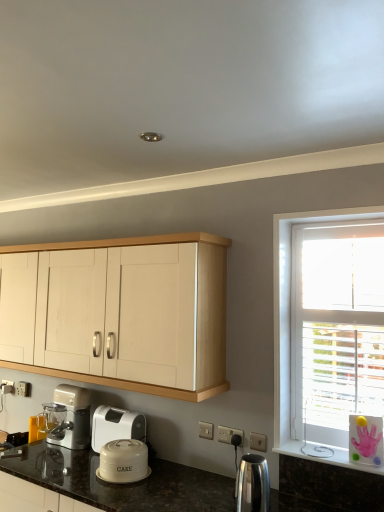
What do you see at coordinates (253, 484) in the screenshot?
I see `polished stainless steel kettle at lower center, the first kitchen appliance in the front-to-back sequence` at bounding box center [253, 484].

In order to face matte silver blender at lower left, positioned as the 2th home appliance in right-to-left order, should I rotate leftwards or rightwards?

You should rotate left by 16.493 degrees.

The width and height of the screenshot is (384, 512). Describe the element at coordinates (206, 430) in the screenshot. I see `white plastic electric outlet at lower center` at that location.

Image resolution: width=384 pixels, height=512 pixels. I want to click on matte white cake container at lower center, acting as the 1th kitchen appliance starting from the back, so click(x=123, y=461).

Image resolution: width=384 pixels, height=512 pixels. What are the coordinates of `polished stainless steel kettle at lower center, acting as the 2th kitchen appliance starting from the back` in the screenshot? It's located at (253, 484).

Can you tell me how much white plastic electric outlet at lower center and light wood cabinet at upper center differ in facing direction?

The facing directions of white plastic electric outlet at lower center and light wood cabinet at upper center are 1.77 degrees apart.

Is white plastic electric outlet at lower center in contact with light wood cabinet at upper center?

No.

Between white plastic electric outlet at lower center and light wood cabinet at upper center, which one is positioned in front?

Positioned in front is light wood cabinet at upper center.

From a real-world perspective, is white plastic electric outlet at lower center on top of light wood cabinet at upper center?

No.

Is matte silver blender at lower left, positioned as the 2th home appliance in right-to-left order, with polished stainless steel kettle at lower center, the first kitchen appliance in the front-to-back sequence?

They are not placed beside each other.

Looking at their sizes, would you say matte silver blender at lower left, which is counted as the 1th home appliance, starting from the left, is wider or thinner than polished stainless steel kettle at lower center, acting as the 2th kitchen appliance starting from the back?

Clearly, matte silver blender at lower left, which is counted as the 1th home appliance, starting from the left, has less width compared to polished stainless steel kettle at lower center, acting as the 2th kitchen appliance starting from the back.

Is matte silver blender at lower left, which is counted as the 1th home appliance, starting from the left, surrounding polished stainless steel kettle at lower center, the first kitchen appliance in the front-to-back sequence?

No, polished stainless steel kettle at lower center, the first kitchen appliance in the front-to-back sequence, is not a part of matte silver blender at lower left, which is counted as the 1th home appliance, starting from the left.

Is polished stainless steel kettle at lower center, which appears as the second kitchen appliance when viewed from the left, oriented away from light wood cabinet at upper center?

polished stainless steel kettle at lower center, which appears as the second kitchen appliance when viewed from the left, does not have its back to light wood cabinet at upper center.

Considering the sizes of objects polished stainless steel kettle at lower center, acting as the 1th kitchen appliance starting from the right, and light wood cabinet at upper center in the image provided, who is thinner, polished stainless steel kettle at lower center, acting as the 1th kitchen appliance starting from the right, or light wood cabinet at upper center?

With smaller width is polished stainless steel kettle at lower center, acting as the 1th kitchen appliance starting from the right.

Between polished stainless steel kettle at lower center, acting as the 2th kitchen appliance starting from the back, and light wood cabinet at upper center, which one has less height?

polished stainless steel kettle at lower center, acting as the 2th kitchen appliance starting from the back, is shorter.

Are polished stainless steel kettle at lower center, the first kitchen appliance in the front-to-back sequence, and light wood cabinet at upper center located far from each other?

No, polished stainless steel kettle at lower center, the first kitchen appliance in the front-to-back sequence, is not far from light wood cabinet at upper center.

Is white plastic container at lower center, marked as the 2th home appliance in a left-to-right arrangement, spatially inside light wood cabinet at upper center, or outside of it?

The correct answer is: outside.

Is light wood cabinet at upper center at the back of white plastic container at lower center, marked as the 2th home appliance in a left-to-right arrangement?

No, white plastic container at lower center, marked as the 2th home appliance in a left-to-right arrangement,'s orientation is not away from light wood cabinet at upper center.

Would you consider white plastic container at lower center, arranged as the 1th home appliance when viewed from the right, to be distant from light wood cabinet at upper center?

Actually, white plastic container at lower center, arranged as the 1th home appliance when viewed from the right, and light wood cabinet at upper center are a little close together.

Is white plastic electric outlet at lower center placed right next to matte silver blender at lower left, positioned as the 2th home appliance in right-to-left order?

No, white plastic electric outlet at lower center is not next to matte silver blender at lower left, positioned as the 2th home appliance in right-to-left order.

From the image's perspective, which one is positioned higher, white plastic electric outlet at lower center or matte silver blender at lower left, which is counted as the 1th home appliance, starting from the left?

white plastic electric outlet at lower center appears higher in the image.

Which is more to the right, white plastic electric outlet at lower center or matte silver blender at lower left, positioned as the 2th home appliance in right-to-left order?

white plastic electric outlet at lower center is more to the right.

From the image's perspective, count 1st home appliances downward from the white plastic electric outlet at lower center and point to it. Please provide its 2D coordinates.

[(72, 418)]

Is polished stainless steel kettle at lower center, the first kitchen appliance in the front-to-back sequence, inside the boundaries of matte white cake container at lower center, acting as the 1th kitchen appliance starting from the back, or outside?

polished stainless steel kettle at lower center, the first kitchen appliance in the front-to-back sequence, is located beyond the bounds of matte white cake container at lower center, acting as the 1th kitchen appliance starting from the back.

Does point (255, 498) come closer to viewer compared to point (102, 458)?

Yes, it is in front of point (102, 458).

Would you consider polished stainless steel kettle at lower center, acting as the 1th kitchen appliance starting from the right, to be distant from matte white cake container at lower center, arranged as the 2th kitchen appliance when viewed from the right?

No, polished stainless steel kettle at lower center, acting as the 1th kitchen appliance starting from the right, is not far from matte white cake container at lower center, arranged as the 2th kitchen appliance when viewed from the right.

Considering the positions of objects polished stainless steel kettle at lower center, which appears as the second kitchen appliance when viewed from the left, and matte white cake container at lower center, arranged as the 2th kitchen appliance when viewed from the right, in the image provided, who is more to the left, polished stainless steel kettle at lower center, which appears as the second kitchen appliance when viewed from the left, or matte white cake container at lower center, arranged as the 2th kitchen appliance when viewed from the right,?

→ From the viewer's perspective, matte white cake container at lower center, arranged as the 2th kitchen appliance when viewed from the right, appears more on the left side.

Would you say white plastic container at lower center, arranged as the 1th home appliance when viewed from the right, is outside polished stainless steel kettle at lower center, acting as the 2th kitchen appliance starting from the back?

Indeed, white plastic container at lower center, arranged as the 1th home appliance when viewed from the right, is completely outside polished stainless steel kettle at lower center, acting as the 2th kitchen appliance starting from the back.

Is point (120, 417) farther from camera compared to point (243, 461)?

Yes, point (120, 417) is farther from viewer.

Which home appliance is the 1st one when counting from the back of the polished stainless steel kettle at lower center, acting as the 2th kitchen appliance starting from the back? Please provide its 2D coordinates.

[(116, 426)]

Can you tell me how much white plastic container at lower center, marked as the 2th home appliance in a left-to-right arrangement, and polished stainless steel kettle at lower center, acting as the 1th kitchen appliance starting from the right, differ in facing direction?

The angular difference between white plastic container at lower center, marked as the 2th home appliance in a left-to-right arrangement, and polished stainless steel kettle at lower center, acting as the 1th kitchen appliance starting from the right, is 2.11 degrees.

The image size is (384, 512). In the image, there is a light wood cabinet at upper center. What are the coordinates of `electric outlet below it (from the image's perspective)` in the screenshot? It's located at (206, 430).

Image resolution: width=384 pixels, height=512 pixels. In order to click on the 2nd home appliance behind the polished stainless steel kettle at lower center, which appears as the second kitchen appliance when viewed from the left in this screenshot , I will do `click(72, 418)`.

Which object lies further to the anchor point matte silver blender at lower left, which is counted as the 1th home appliance, starting from the left, white plastic container at lower center, marked as the 2th home appliance in a left-to-right arrangement, or white plastic electric outlet at lower center?

white plastic electric outlet at lower center is positioned further to the anchor matte silver blender at lower left, which is counted as the 1th home appliance, starting from the left.

Considering their positions, is white plastic electric outlet at lower center positioned closer to white plastic container at lower center, marked as the 2th home appliance in a left-to-right arrangement, than light wood cabinet at upper center?

white plastic electric outlet at lower center is positioned closer to the anchor white plastic container at lower center, marked as the 2th home appliance in a left-to-right arrangement.

Which object lies nearer to the anchor point polished stainless steel kettle at lower center, acting as the 2th kitchen appliance starting from the back, matte silver blender at lower left, positioned as the 2th home appliance in right-to-left order, or white plastic container at lower center, arranged as the 1th home appliance when viewed from the right?

white plastic container at lower center, arranged as the 1th home appliance when viewed from the right.

Which object lies nearer to the anchor point polished stainless steel kettle at lower center, the first kitchen appliance in the front-to-back sequence, matte white cake container at lower center, which appears as the 2th kitchen appliance when viewed from the front, or white plastic electric outlet at lower center?

Among the two, white plastic electric outlet at lower center is located nearer to polished stainless steel kettle at lower center, the first kitchen appliance in the front-to-back sequence.

When comparing their distances from matte white cake container at lower center, the 1th kitchen appliance positioned from the left, does matte silver blender at lower left, which is counted as the 1th home appliance, starting from the left, or white plastic electric outlet at lower center seem closer?

white plastic electric outlet at lower center.

Based on their spatial positions, is white plastic container at lower center, arranged as the 1th home appliance when viewed from the right, or matte silver blender at lower left, positioned as the 2th home appliance in right-to-left order, further from matte white cake container at lower center, acting as the 1th kitchen appliance starting from the back?

Based on the image, matte silver blender at lower left, positioned as the 2th home appliance in right-to-left order, appears to be further to matte white cake container at lower center, acting as the 1th kitchen appliance starting from the back.

Which object lies further to the anchor point polished stainless steel kettle at lower center, the first kitchen appliance in the front-to-back sequence, light wood cabinet at upper center or matte white cake container at lower center, which appears as the 2th kitchen appliance when viewed from the front?

The object further to polished stainless steel kettle at lower center, the first kitchen appliance in the front-to-back sequence, is light wood cabinet at upper center.

Looking at this image, based on their spatial positions, is white plastic container at lower center, arranged as the 1th home appliance when viewed from the right, or matte white cake container at lower center, acting as the 1th kitchen appliance starting from the back, closer to white plastic electric outlet at lower center?

Based on the image, matte white cake container at lower center, acting as the 1th kitchen appliance starting from the back, appears to be nearer to white plastic electric outlet at lower center.

Locate an element on the screen. Image resolution: width=384 pixels, height=512 pixels. home appliance situated between matte silver blender at lower left, positioned as the 2th home appliance in right-to-left order, and white plastic electric outlet at lower center from left to right is located at coordinates (116, 426).

Where is `kitchen appliance between white plastic container at lower center, marked as the 2th home appliance in a left-to-right arrangement, and white plastic electric outlet at lower center from left to right`? The image size is (384, 512). kitchen appliance between white plastic container at lower center, marked as the 2th home appliance in a left-to-right arrangement, and white plastic electric outlet at lower center from left to right is located at coordinates (123, 461).

Where is `electric outlet located between matte silver blender at lower left, which is counted as the 1th home appliance, starting from the left, and polished stainless steel kettle at lower center, acting as the 2th kitchen appliance starting from the back, in the left-right direction`? The image size is (384, 512). electric outlet located between matte silver blender at lower left, which is counted as the 1th home appliance, starting from the left, and polished stainless steel kettle at lower center, acting as the 2th kitchen appliance starting from the back, in the left-right direction is located at coordinates (206, 430).

Locate an element on the screen. This screenshot has width=384, height=512. electric outlet between matte white cake container at lower center, acting as the 1th kitchen appliance starting from the back, and polished stainless steel kettle at lower center, acting as the 2th kitchen appliance starting from the back, from left to right is located at coordinates (206, 430).